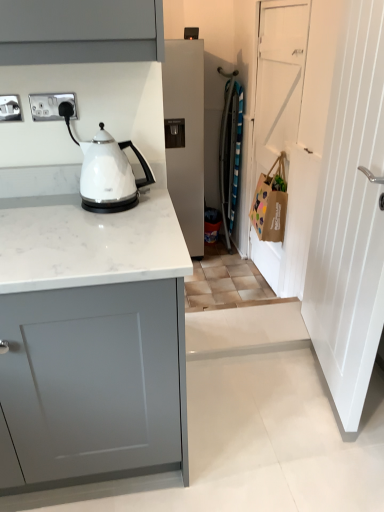
Question: Is white wooden door at right, the first door when ordered from front to back, in front of or behind brown paper bag at right in the image?

Choices:
 (A) behind
 (B) front

Answer: (B)

Question: From a real-world perspective, is white wooden door at right, the first door when ordered from front to back, positioned above or below brown paper bag at right?

Choices:
 (A) below
 (B) above

Answer: (B)

Question: Which is nearer to the white matte door at right, the 2th door from the front?

Choices:
 (A) brown paper bag at right
 (B) chrome metallic plug socket at left, the second electric outlet from the left
 (C) white wooden door at right, the first door when ordered from front to back
 (D) white glossy kettle at left
 (E) white matte refrigerator at center

Answer: (A)

Question: Considering the real-world distances, which object is closest to the white wooden door at right, the first door when ordered from front to back?

Choices:
 (A) white matte door at right, which ranks as the first door in back-to-front order
 (B) brown paper bag at right
 (C) white matte refrigerator at center
 (D) satin silver socket at upper left, which appears as the second electric outlet when viewed from the right
 (E) white marble countertop at center

Answer: (E)